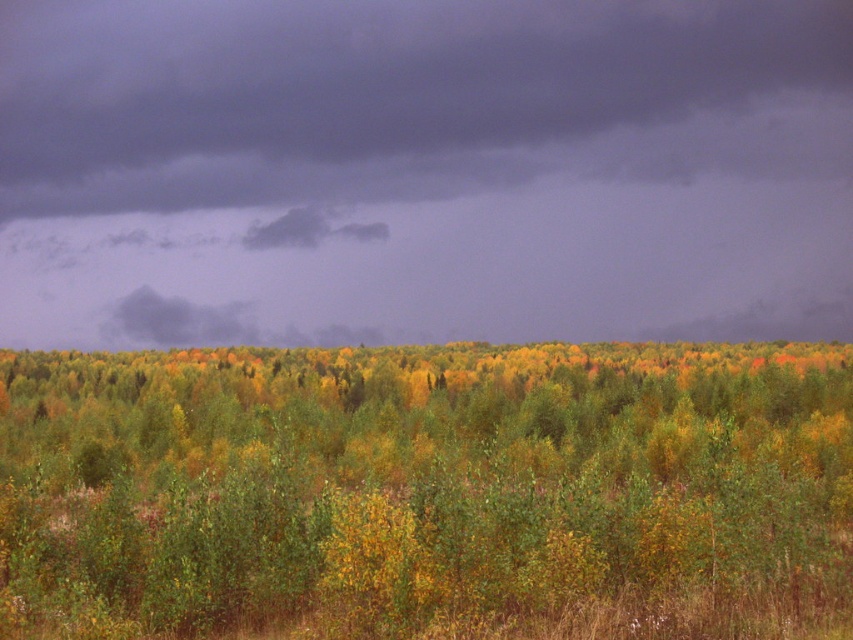
Question: Considering the relative positions of dark gray cloud at upper center and green leafy forest at center in the image provided, where is dark gray cloud at upper center located with respect to green leafy forest at center?

Choices:
 (A) right
 (B) left

Answer: (B)

Question: Is dark gray cloud at upper center to the left of green leafy forest at center from the viewer's perspective?

Choices:
 (A) yes
 (B) no

Answer: (A)

Question: Which point is farther to the camera?

Choices:
 (A) (171, 44)
 (B) (822, 451)

Answer: (A)

Question: In this image, where is dark gray cloud at upper center located relative to green leafy forest at center?

Choices:
 (A) left
 (B) right

Answer: (A)

Question: Which of the following is the farthest from the observer?

Choices:
 (A) (808, 344)
 (B) (300, 314)

Answer: (B)